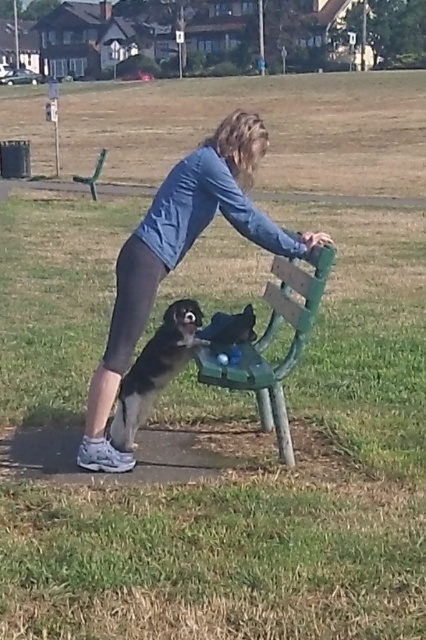
Can you confirm if blue denim jacket at upper center is shorter than green wooden bench at center?

Incorrect, blue denim jacket at upper center's height does not fall short of green wooden bench at center's.

Does blue denim jacket at upper center have a greater width compared to green wooden bench at center?

Yes, blue denim jacket at upper center is wider than green wooden bench at center.

The image size is (426, 640). Find the location of `blue denim jacket at upper center`. blue denim jacket at upper center is located at coordinates (180, 256).

Locate an element on the screen. blue denim jacket at upper center is located at coordinates (180, 256).